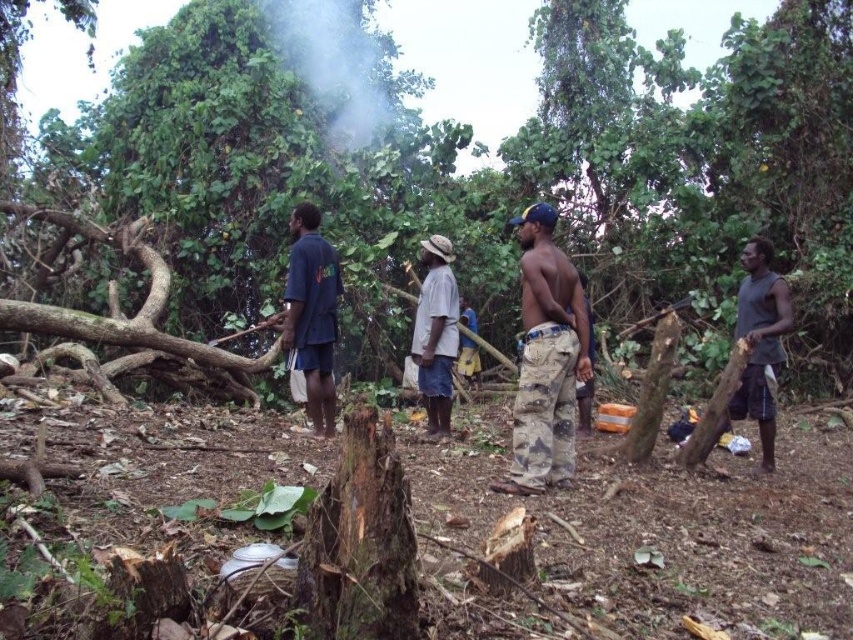
You are standing at the edge of the forest clearing and notice a point marked at coordinates (312,314). What object or person is located at that specific coordinate?

The point at coordinates (312,314) corresponds to the dark blue shirt at center.